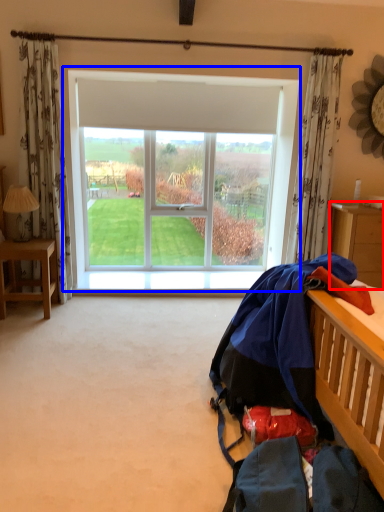
Question: Which object appears farthest to the camera in this image, nightstand (highlighted by a red box) or window (highlighted by a blue box)?

Choices:
 (A) nightstand
 (B) window

Answer: (B)